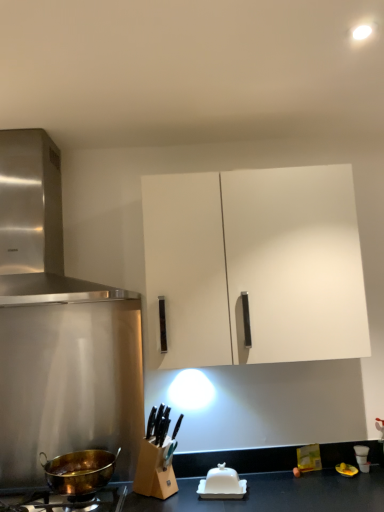
Find the location of a particular element. The height and width of the screenshot is (512, 384). vacant point above stainless steel range hood at upper left (from a real-world perspective) is located at coordinates (58, 122).